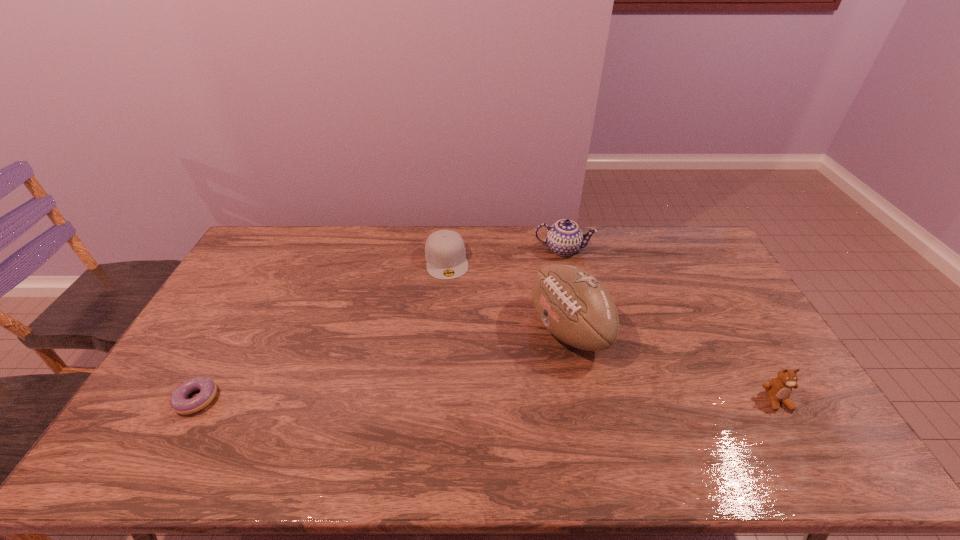
The width and height of the screenshot is (960, 540). I want to click on doughnut, so click(x=179, y=403).

At what (x,y) coordinates should I click in order to perform the action: click on the shortest object. Please return your answer as a coordinate pair (x, y). This screenshot has height=540, width=960. Looking at the image, I should click on (179, 403).

This screenshot has height=540, width=960. What are the coordinates of `the rightmost object` in the screenshot? It's located at (778, 389).

Where is `teddy bear`? The width and height of the screenshot is (960, 540). teddy bear is located at coordinates (778, 389).

Identify the location of the second object from left to right. (445, 253).

Identify the location of the second shortest object. Image resolution: width=960 pixels, height=540 pixels. (445, 253).

Find the location of `football (American)`. football (American) is located at coordinates (574, 306).

Locate an element on the screen. The image size is (960, 540). the third nearest object is located at coordinates (574, 306).

In order to click on chinaware in this screenshot , I will do `click(564, 237)`.

Locate an element on the screen. free location located 0.190m on the back of the doughnut is located at coordinates pyautogui.click(x=234, y=331).